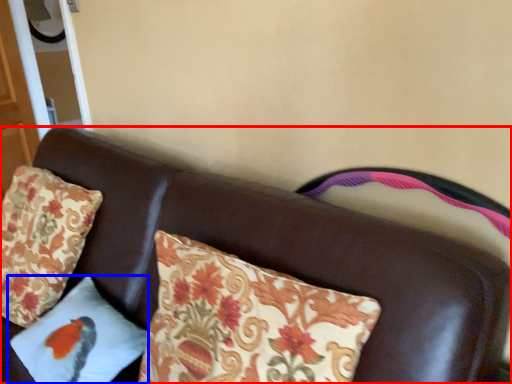
Question: Which of the following is the closest to the observer, furniture (highlighted by a red box) or pillow (highlighted by a blue box)?

Choices:
 (A) furniture
 (B) pillow

Answer: (A)